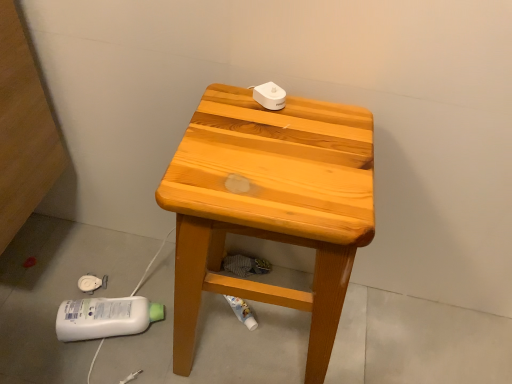
Question: Looking at their shapes, would you say light brown wooden stool at center is wider or thinner than wooden stool at center?

Choices:
 (A) thin
 (B) wide

Answer: (A)

Question: In the image, is light brown wooden stool at center positioned in front of or behind wooden stool at center?

Choices:
 (A) front
 (B) behind

Answer: (A)

Question: Would you say light brown wooden stool at center is to the left or to the right of wooden stool at center in the picture?

Choices:
 (A) right
 (B) left

Answer: (A)

Question: Is wooden stool at center taller or shorter than light brown wooden stool at center?

Choices:
 (A) tall
 (B) short

Answer: (B)

Question: Does point (510, 360) appear closer or farther from the camera than point (198, 256)?

Choices:
 (A) closer
 (B) farther

Answer: (B)

Question: From the image's perspective, is wooden stool at center above or below light brown wooden stool at center?

Choices:
 (A) above
 (B) below

Answer: (B)

Question: Considering the positions of wooden stool at center and light brown wooden stool at center in the image, is wooden stool at center bigger or smaller than light brown wooden stool at center?

Choices:
 (A) small
 (B) big

Answer: (A)